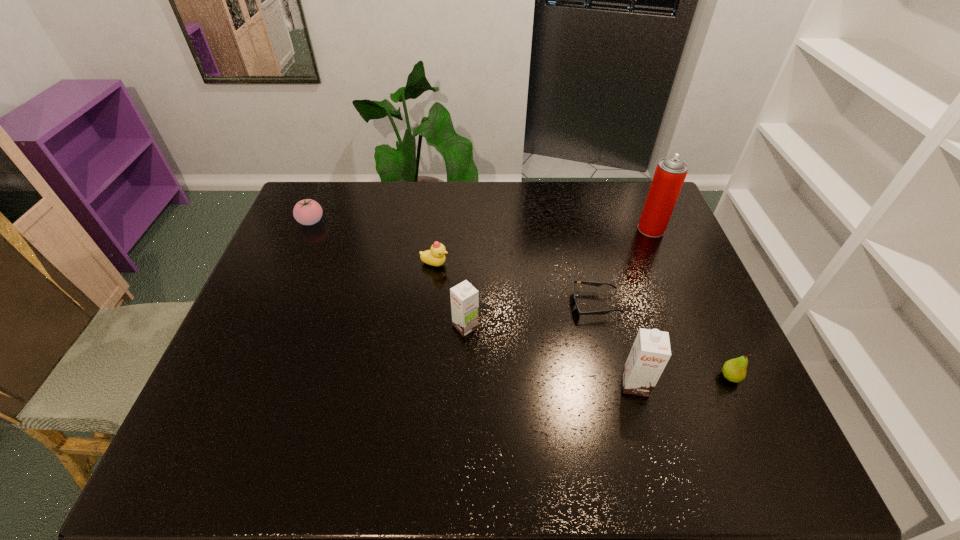
I want to click on the fifth shortest object, so click(x=464, y=297).

Locate an element on the screen. The height and width of the screenshot is (540, 960). the shorter chocolate milk is located at coordinates (464, 297).

Where is `the right chocolate milk`? The height and width of the screenshot is (540, 960). the right chocolate milk is located at coordinates (651, 351).

In order to click on the sixth shortest object in this screenshot , I will do `click(651, 351)`.

Locate an element on the screen. The height and width of the screenshot is (540, 960). tomato is located at coordinates (307, 212).

What are the coordinates of `the second object from left to right` in the screenshot? It's located at (435, 256).

Where is `the third farthest object`? The width and height of the screenshot is (960, 540). the third farthest object is located at coordinates (435, 256).

Where is `sunglasses`? The width and height of the screenshot is (960, 540). sunglasses is located at coordinates point(602,312).

Find the location of a particular element. The image size is (960, 540). aerosol can is located at coordinates (670, 173).

At what (x,y) coordinates should I click in order to perform the action: click on pear. Please return your answer as a coordinate pair (x, y). This screenshot has width=960, height=540. Looking at the image, I should click on (734, 370).